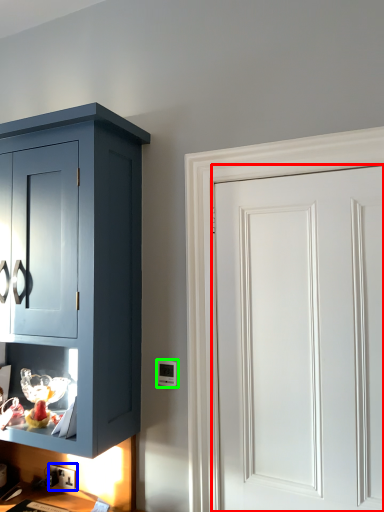
Question: Considering the real-world distances, which object is closest to door (highlighted by a red box)? electric outlet (highlighted by a blue box) or light switch (highlighted by a green box).

Choices:
 (A) electric outlet
 (B) light switch

Answer: (B)